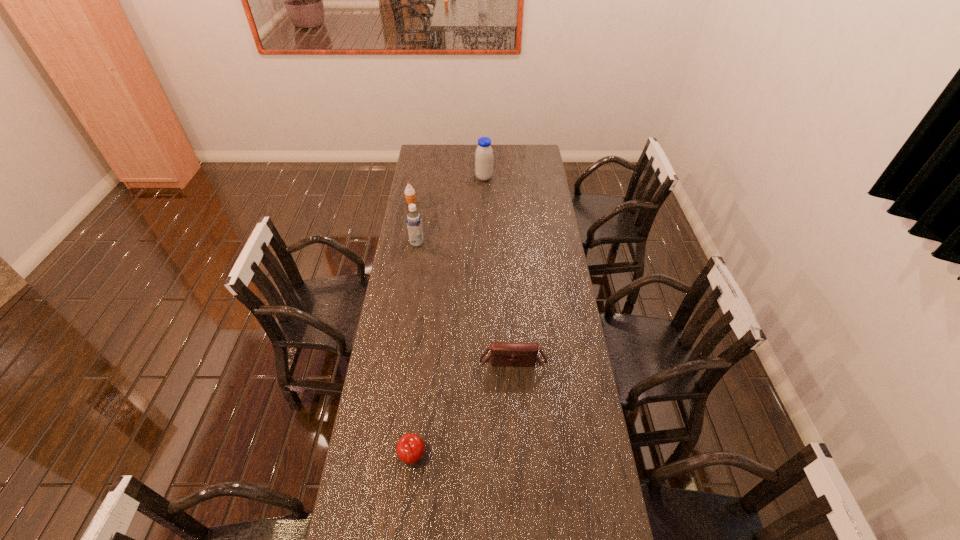
Where is `free space located 0.340m on the right of the icecream`? This screenshot has width=960, height=540. free space located 0.340m on the right of the icecream is located at coordinates (483, 204).

I want to click on free space located on the front flap of the shoulder bag, so click(516, 408).

Image resolution: width=960 pixels, height=540 pixels. In order to click on vacant point located on the back of the third object from left to right in this screenshot , I will do `click(424, 345)`.

Image resolution: width=960 pixels, height=540 pixels. Find the location of `soya milk that is at the left edge`. soya milk that is at the left edge is located at coordinates (414, 223).

You are a GUI agent. You are given a task and a screenshot of the screen. Output one action in this format:
    pyautogui.click(x=<x>, y=<y>)
    Task: Click on the icecream that is at the left edge
    The height and width of the screenshot is (540, 960).
    Given the screenshot: What is the action you would take?
    pyautogui.click(x=409, y=192)

You are a GUI agent. You are given a task and a screenshot of the screen. Output one action in this format:
    pyautogui.click(x=<x>, y=<y>)
    Task: Click on the cherry present at the left edge
    Image resolution: width=960 pixels, height=540 pixels.
    Given the screenshot: What is the action you would take?
    pyautogui.click(x=410, y=448)

You are a GUI agent. You are given a task and a screenshot of the screen. Output one action in this format:
    pyautogui.click(x=<x>, y=<y>)
    Task: Click on the object at the right edge
    This screenshot has width=960, height=540.
    Given the screenshot: What is the action you would take?
    pyautogui.click(x=517, y=354)

The width and height of the screenshot is (960, 540). I want to click on vacant space at the far edge of the desktop, so click(x=503, y=160).

Locate an element on the screen. This screenshot has width=960, height=540. free space at the left edge of the desktop is located at coordinates (436, 202).

What are the coordinates of `free region at the right edge of the desktop` in the screenshot? It's located at (562, 276).